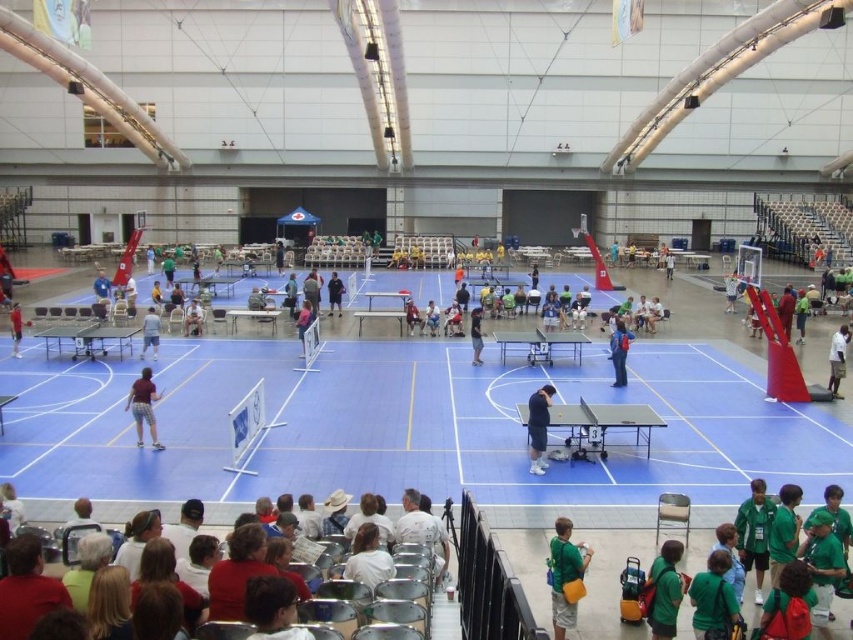
Question: Among these objects, which one is farthest from the camera?

Choices:
 (A) blue rubber table at center
 (B) matte brown shorts at center
 (C) light blue shirt at center

Answer: (C)

Question: Which of the following is the farthest from the observer?

Choices:
 (A) (759, 580)
 (B) (566, 518)
 (C) (836, 346)
 (D) (331, 308)

Answer: (D)

Question: Can you confirm if white fabric chairs at lower center is wider than matte black shirt at center?

Choices:
 (A) no
 (B) yes

Answer: (B)

Question: Is blue rubber table at center below matte brown shorts at center?

Choices:
 (A) yes
 (B) no

Answer: (B)

Question: Does green jersey at lower right appear on the right side of white matte shirt at center?

Choices:
 (A) yes
 (B) no

Answer: (B)

Question: Which point is closer to the camera taking this photo?

Choices:
 (A) (329, 284)
 (B) (140, 400)

Answer: (B)